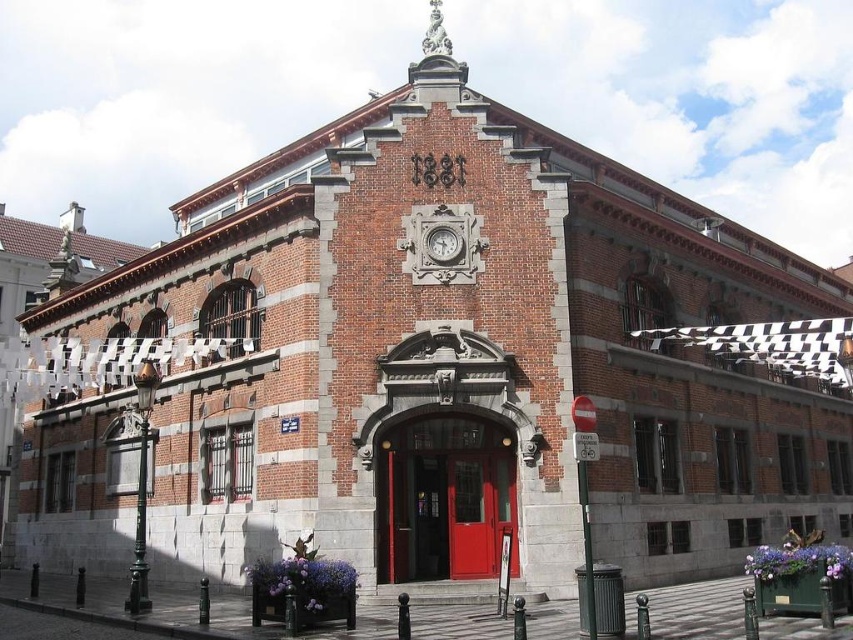
Between point (451, 573) and point (450, 241), which one is positioned behind?

Positioned behind is point (450, 241).

What do you see at coordinates (444, 497) in the screenshot?
I see `smooth red door at center` at bounding box center [444, 497].

Where is `smooth red door at center`? The image size is (853, 640). smooth red door at center is located at coordinates tap(444, 497).